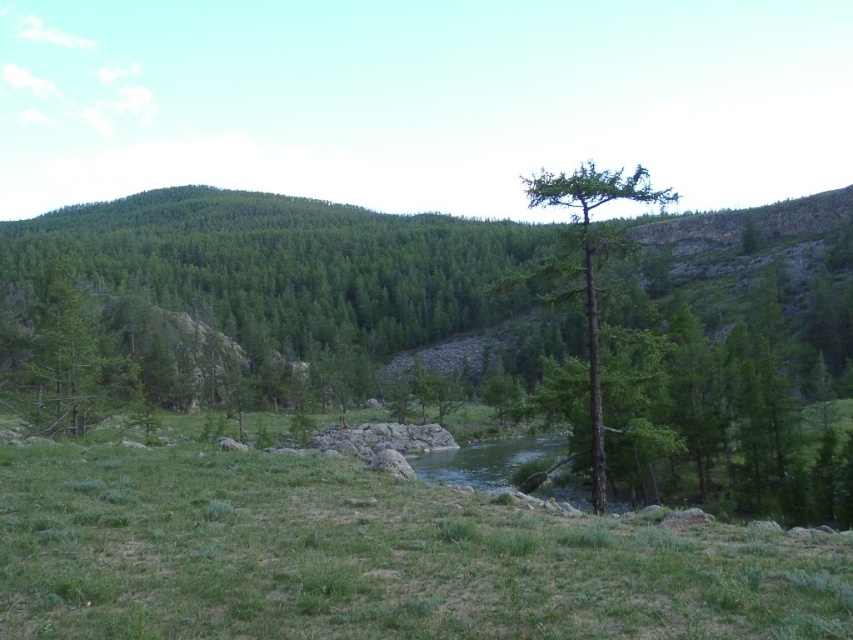
Question: Which point is closer to the camera?

Choices:
 (A) green grassy at center
 (B) green rough bark tree at center
 (C) green matte tree at center
 (D) green matte tree at left

Answer: (A)

Question: Which of the following is the farthest from the observer?

Choices:
 (A) (624, 193)
 (B) (57, 339)
 (C) (155, 637)

Answer: (B)

Question: Which of these objects is positioned farthest from the green matte tree at left?

Choices:
 (A) green grassy at center
 (B) green rough bark tree at center

Answer: (B)

Question: Does green matte tree at center lie in front of green rough bark tree at center?

Choices:
 (A) yes
 (B) no

Answer: (B)

Question: Is the position of green matte tree at left less distant than that of green rough bark tree at center?

Choices:
 (A) yes
 (B) no

Answer: (B)

Question: Is green matte tree at center behind green grassy at center?

Choices:
 (A) yes
 (B) no

Answer: (A)